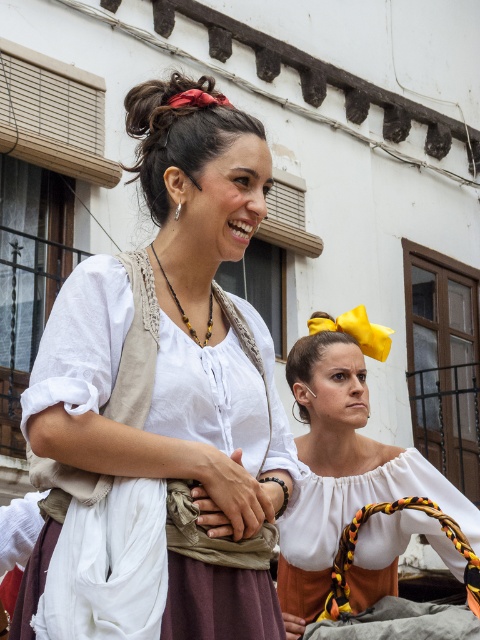
You are a photographer trying to capture both women in a single shot. Given their positions at point (141, 170) and point (307, 397), will you need to adjust your camera angle to include both in the frame?

Point (141, 170) is in front of point (307, 397), so you will need to adjust your camera angle to include both in the frame as they are not aligned on the same plane.